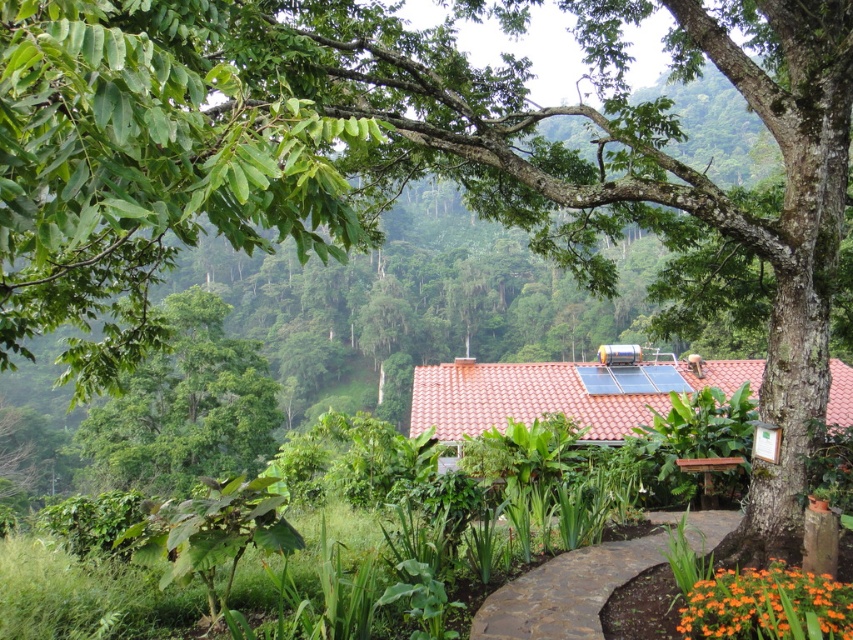
Between orange matte flower at lower right and brown wooden bench at lower right, which one has more height?

With more height is brown wooden bench at lower right.

Does orange matte flower at lower right lie behind brown wooden bench at lower right?

No, orange matte flower at lower right is in front of brown wooden bench at lower right.

Does point (721, 588) come in front of point (691, 461)?

Yes, it is in front of point (691, 461).

This screenshot has height=640, width=853. Find the location of `orange matte flower at lower right`. orange matte flower at lower right is located at coordinates (767, 605).